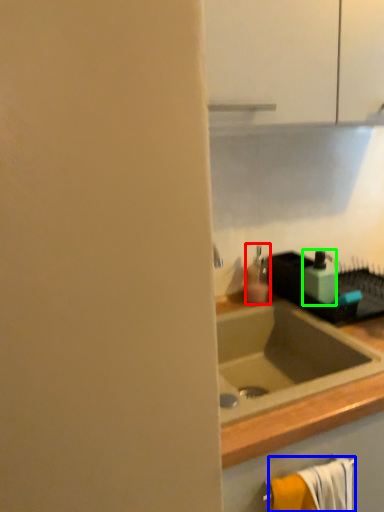
Question: Which object is the closest to the soap dispenser (highlighted by a red box)? Choose among these: bath towel (highlighted by a blue box) or soap dispenser (highlighted by a green box).

Choices:
 (A) bath towel
 (B) soap dispenser

Answer: (B)